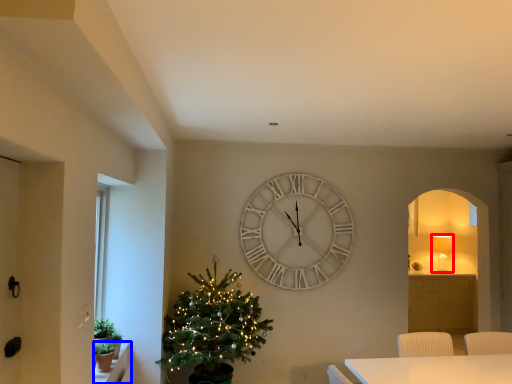
Question: Which of the following is the farthest to the observer, lamp (highlighted by a red box) or window sill (highlighted by a blue box)?

Choices:
 (A) lamp
 (B) window sill

Answer: (A)